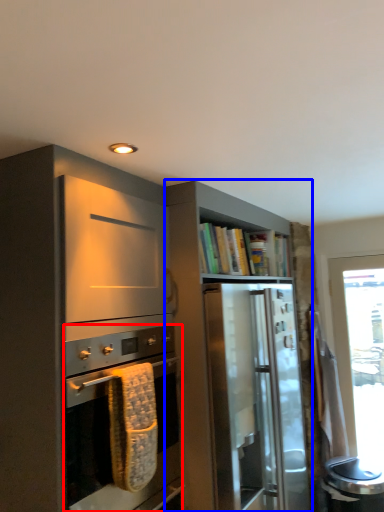
Question: Which object is closer to the camera taking this photo, oven (highlighted by a red box) or cabinetry (highlighted by a blue box)?

Choices:
 (A) oven
 (B) cabinetry

Answer: (A)